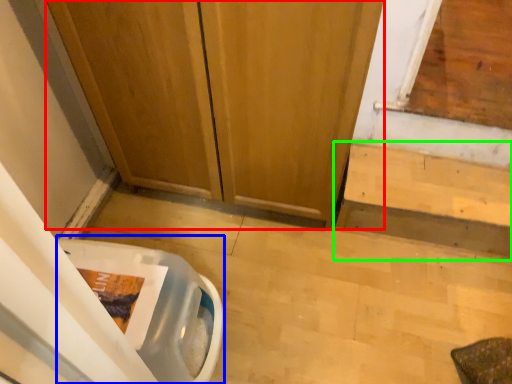
Question: Which object is the farthest from door (highlighted by a red box)? Choose among these: toilet bowl (highlighted by a blue box) or stairwell (highlighted by a green box).

Choices:
 (A) toilet bowl
 (B) stairwell

Answer: (A)